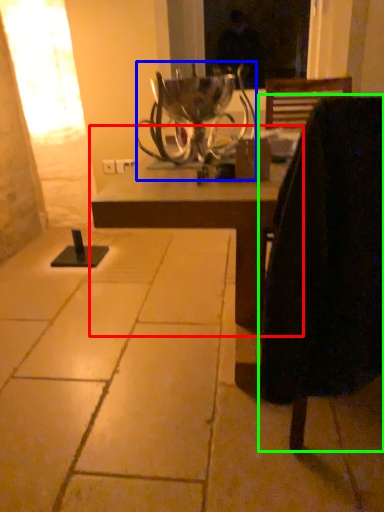
Question: Which object is the closest to the table (highlighted by a red box)? Choose among these: candle holder (highlighted by a blue box) or chair (highlighted by a green box).

Choices:
 (A) candle holder
 (B) chair

Answer: (B)